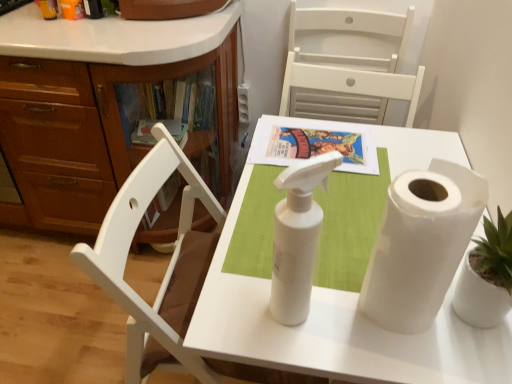
You are a GUI agent. You are given a task and a screenshot of the screen. Output one action in this format:
    pyautogui.click(x=<x>, y=<y>)
    Task: Click on the unoccupied space behind white paper at right
    The width and height of the screenshot is (512, 384).
    Given the screenshot: What is the action you would take?
    pyautogui.click(x=350, y=223)